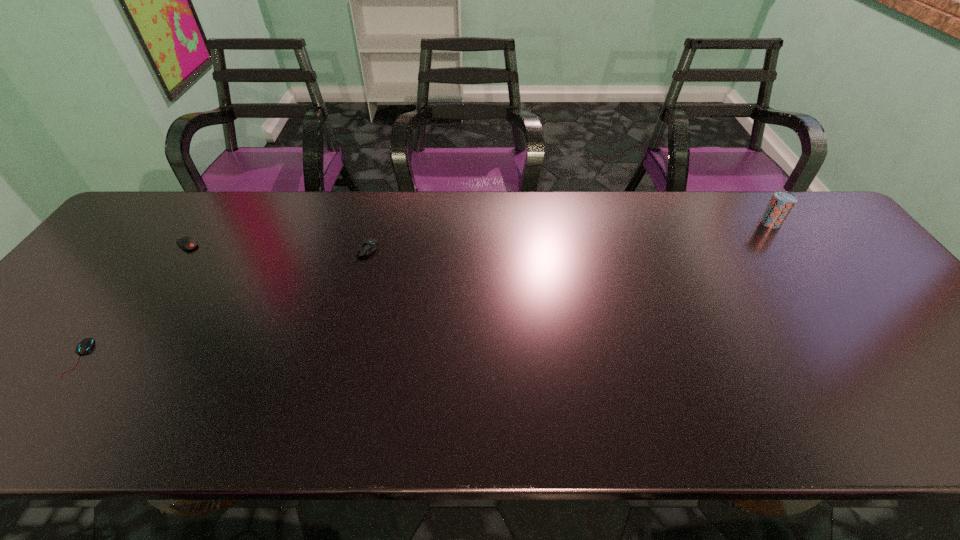
Locate an element on the screen. The image size is (960, 540). object that stands as the closest to the farthest object is located at coordinates (x=366, y=247).

The width and height of the screenshot is (960, 540). I want to click on mouse that is the closest to the third object from left to right, so click(186, 243).

Identify which mouse is located as the second nearest to the second object from right to left. Please provide its 2D coordinates. Your answer should be formatted as a tuple, i.e. [(x, y)], where the tuple contains the x and y coordinates of a point satisfying the conditions above.

[(86, 344)]